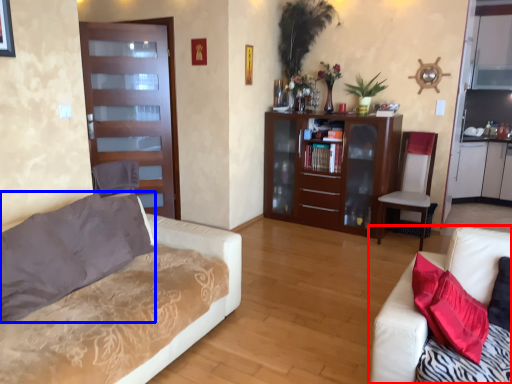
Question: Which object is closer to the camera taking this photo, studio couch (highlighted by a red box) or pillow (highlighted by a blue box)?

Choices:
 (A) studio couch
 (B) pillow

Answer: (A)